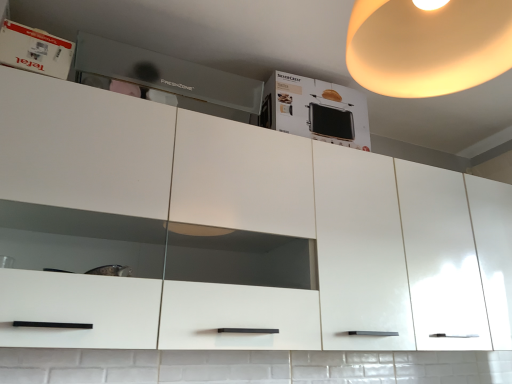
Question: Is warm matte lampshade at upper right wider or thinner than white glossy box at upper left?

Choices:
 (A) thin
 (B) wide

Answer: (B)

Question: From a real-world perspective, relative to white glossy box at upper left, is warm matte lampshade at upper right vertically above or below?

Choices:
 (A) above
 (B) below

Answer: (A)

Question: Considering the real-world distances, which object is closest to the white glossy box at upper left?

Choices:
 (A) white cardboard box at upper center
 (B) warm matte lampshade at upper right
 (C) matte gray drawer at upper center

Answer: (C)

Question: Estimate the real-world distances between objects in this image. Which object is farther from the white cardboard box at upper center?

Choices:
 (A) white glossy box at upper left
 (B) warm matte lampshade at upper right
 (C) matte gray drawer at upper center

Answer: (A)